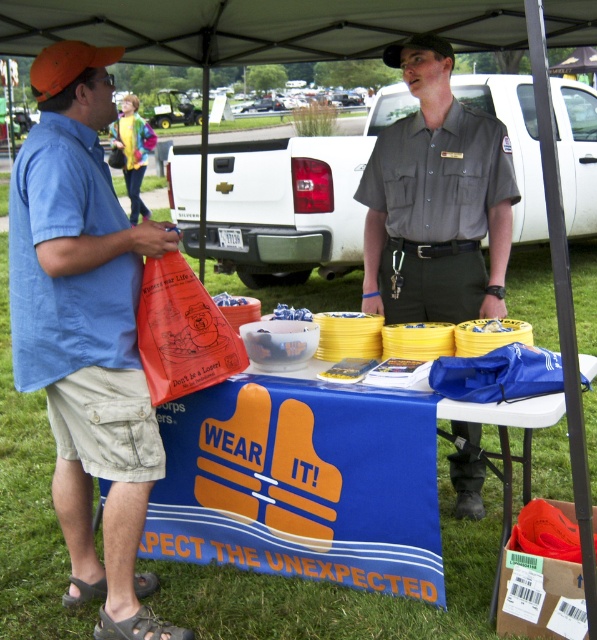
Question: Which point is farther to the camera?

Choices:
 (A) (8, 42)
 (B) (392, 272)
 (C) (70, 205)

Answer: (A)

Question: Which object is the farthest from the white fabric canopy at upper center?

Choices:
 (A) blue fabric table at center
 (B) orange fabric bag at left

Answer: (A)

Question: Is orange fabric bag at left bigger than gray uniform at center?

Choices:
 (A) no
 (B) yes

Answer: (B)

Question: Is blue fabric table at center thinner than white fabric canopy at upper center?

Choices:
 (A) no
 (B) yes

Answer: (B)

Question: Which point is farther to the camera?

Choices:
 (A) white fabric canopy at upper center
 (B) orange fabric baseball cap at upper left
 (C) gray uniform at center
 (D) blue fabric table at center

Answer: (A)

Question: Where is white fabric canopy at upper center located in relation to orange fabric baseball cap at upper left in the image?

Choices:
 (A) below
 (B) above

Answer: (B)